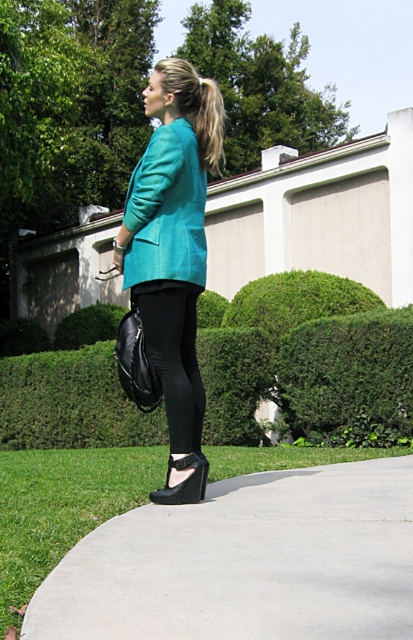
You are a fashion designer observing the woman in the image. You need to determine the spatial relationship between her teal fabric blazer at center and her blonde hair at upper center. Which object is positioned higher from the ground?

The teal fabric blazer at center is taller than blonde hair at upper center, so the blazer is positioned higher from the ground.

You are a landscape architect designing a garden and want to know if the green leafy hedge at center can be placed in a smaller area than the black smooth leggings at center. Based on the image, is this possible?

The green leafy hedge at center occupies less space than the black smooth leggings at center, so yes, it can be placed in a smaller area.